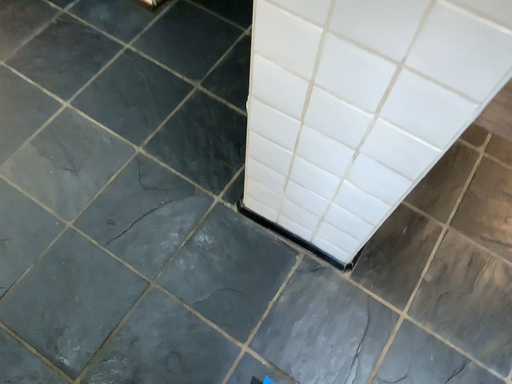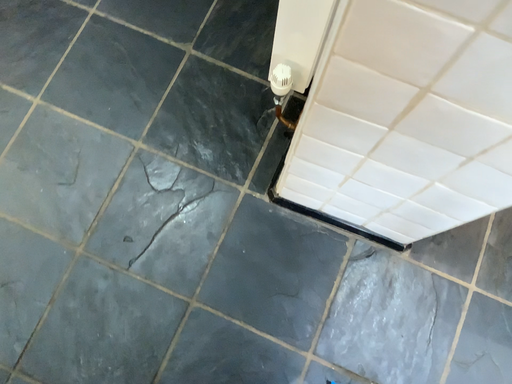
Question: Which way did the camera rotate in the video?

Choices:
 (A) rotated downward
 (B) rotated upward

Answer: (A)